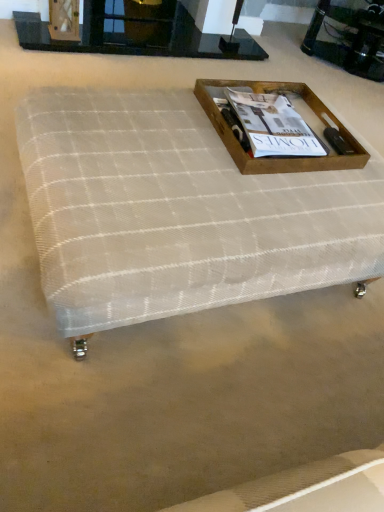
Identify the location of free space in front of wooden tray at center. (238, 196).